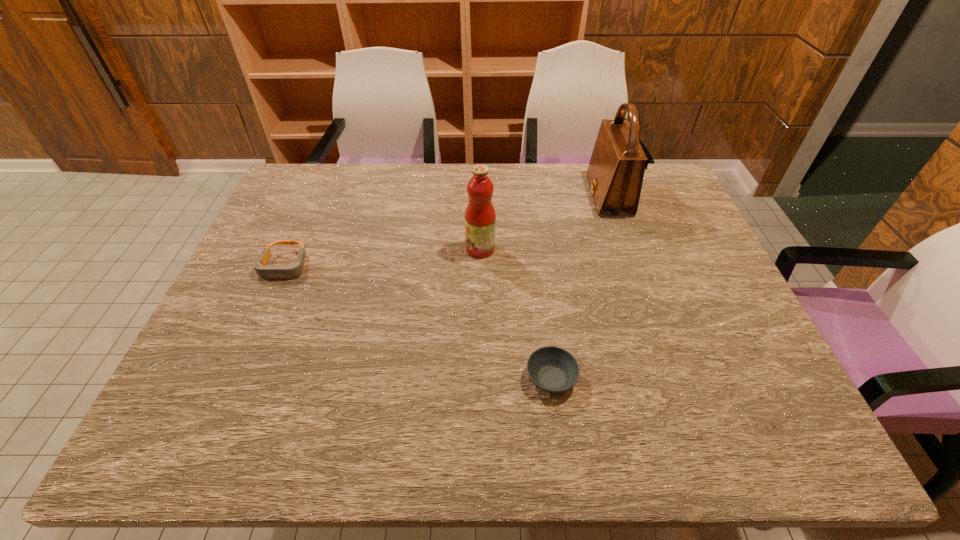
You are a GUI agent. You are given a task and a screenshot of the screen. Output one action in this format:
    pyautogui.click(x=<x>, y=<y>)
    Task: Click on the free space between the second object from right to left and the farthest object
    The height and width of the screenshot is (540, 960).
    Given the screenshot: What is the action you would take?
    pyautogui.click(x=580, y=287)

This screenshot has height=540, width=960. I want to click on free spot between the leftmost object and the rightmost object, so click(446, 231).

Identify which object is the second nearest to the third object from right to left. Please provide its 2D coordinates. Your answer should be formatted as a tuple, i.e. [(x, y)], where the tuple contains the x and y coordinates of a point satisfying the conditions above.

[(615, 174)]

The height and width of the screenshot is (540, 960). Identify the location of object that can be found as the second closest to the soup bowl. (615, 174).

Where is `vacant position in the image that satisfies the following two spatial constraints: 1. on the front flap of the rightmost object; 2. on the front side of the soup bowl`? vacant position in the image that satisfies the following two spatial constraints: 1. on the front flap of the rightmost object; 2. on the front side of the soup bowl is located at coordinates (671, 379).

I want to click on free space that satisfies the following two spatial constraints: 1. on the front label of the third object from right to left; 2. on the back side of the nearest object, so click(x=480, y=379).

I want to click on free space that satisfies the following two spatial constraints: 1. on the front flap of the rightmost object; 2. on the front and back of the goggles, so click(x=633, y=267).

Locate an element on the screen. vacant space that satisfies the following two spatial constraints: 1. on the front label of the second tallest object; 2. on the back side of the nearest object is located at coordinates (480, 379).

Where is `vacant area in the image that satisfies the following two spatial constraints: 1. on the front and back of the leftmost object; 2. on the left side of the third object from left to right`? vacant area in the image that satisfies the following two spatial constraints: 1. on the front and back of the leftmost object; 2. on the left side of the third object from left to right is located at coordinates (235, 379).

Identify the location of free location that satisfies the following two spatial constraints: 1. on the front and back of the third object from left to right; 2. on the left side of the leftmost object. click(235, 379).